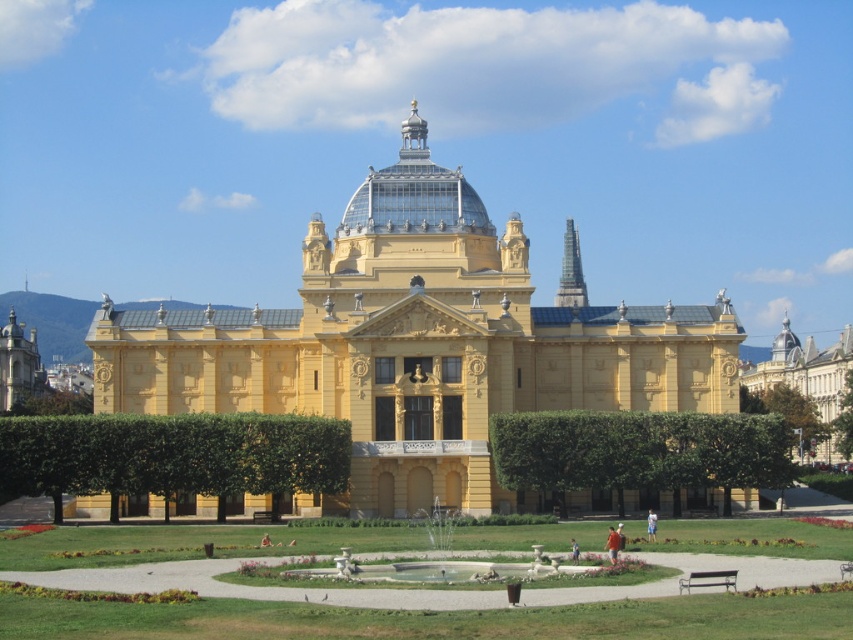
Question: Is green leafy hedge at lower right to the left of yellow stone building at right from the viewer's perspective?

Choices:
 (A) yes
 (B) no

Answer: (A)

Question: Estimate the real-world distances between objects in this image. Which object is closer to the yellow matte building at center?

Choices:
 (A) blue fabric shirt at center
 (B) green leafy hedge at lower right
 (C) yellow stone building at right

Answer: (B)

Question: Which point is closer to the camera taking this photo?

Choices:
 (A) (575, 544)
 (B) (614, 545)
 (C) (236, 444)
 (D) (769, 369)

Answer: (B)

Question: Does green leafy hedge at lower center have a smaller size compared to blue fabric person at center?

Choices:
 (A) yes
 (B) no

Answer: (B)

Question: Which point is farther from the camera taking this photo?

Choices:
 (A) coord(801,358)
 (B) coord(647,513)

Answer: (A)

Question: Can you confirm if yellow matte building at center is positioned below blue fabric person at center?

Choices:
 (A) no
 (B) yes

Answer: (A)